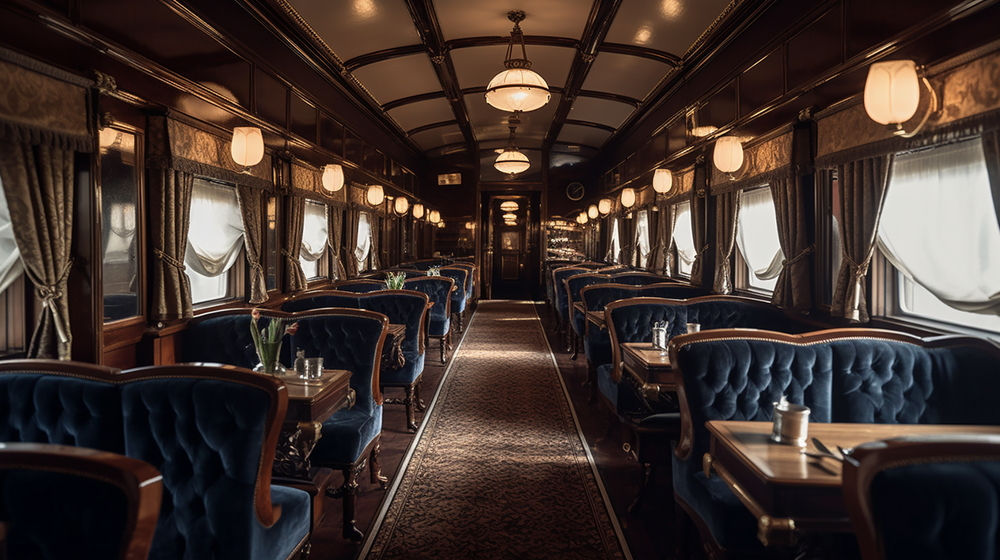
Where is `upholstered seat`? The height and width of the screenshot is (560, 1000). upholstered seat is located at coordinates [x=214, y=466], [x=760, y=391], [x=335, y=336], [x=411, y=311], [x=440, y=289], [x=457, y=274], [x=634, y=323], [x=602, y=297], [x=575, y=284], [x=560, y=274].